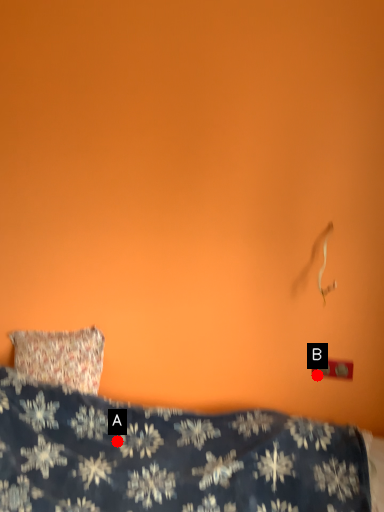
Question: Two points are circled on the image, labeled by A and B beside each circle. Among these points, which one is farthest from the camera?

Choices:
 (A) A is further
 (B) B is further

Answer: (B)